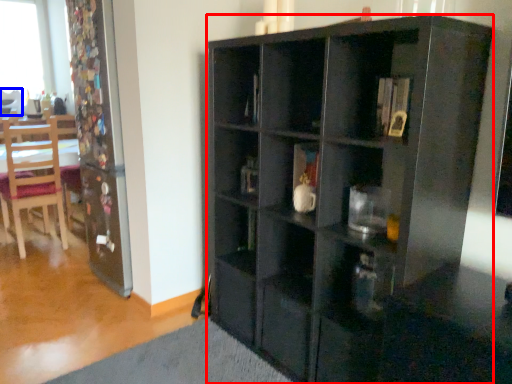
Question: Which of the following is the farthest to the observer, cabinetry (highlighted by a red box) or chair (highlighted by a blue box)?

Choices:
 (A) cabinetry
 (B) chair

Answer: (B)